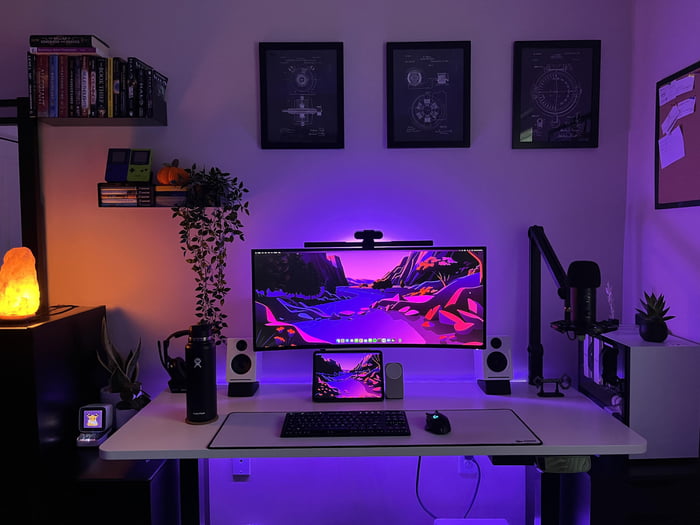
In order to click on decorative pumpkin in this screenshot , I will do `click(171, 176)`.